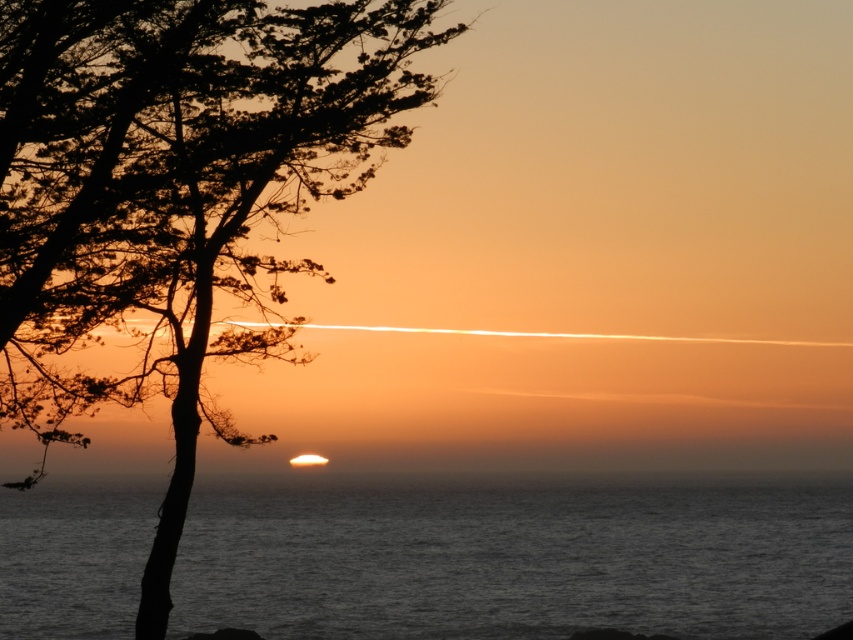
You are standing in the sunset scene by the sea and notice a specific point marked at coordinates (173, 195). Based on the scene description, can you determine what object this point is located on?

The point at (173, 195) is located on the silhouette wood at left, as indicated by the objects description.